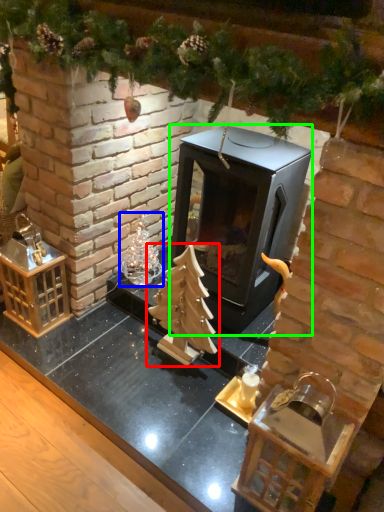
Question: Which object is positioned farthest from christmas tree (highlighted by a red box)? Select from christmas decoration (highlighted by a blue box) and fireplace (highlighted by a green box).

Choices:
 (A) christmas decoration
 (B) fireplace

Answer: (A)